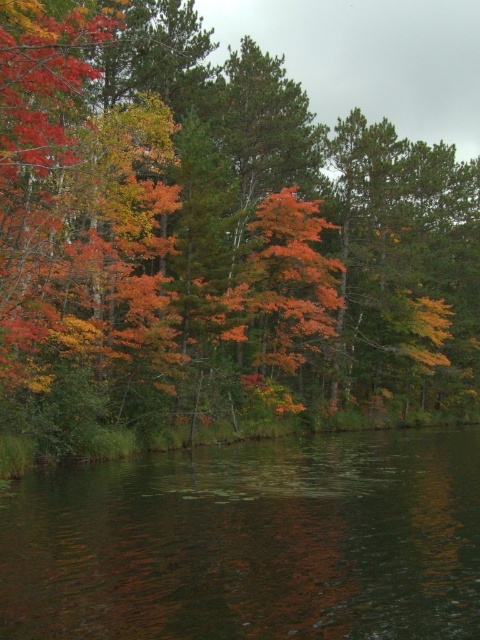
Can you confirm if orange leafy tree at center is positioned to the left of dark reflective water at lower center?

In fact, orange leafy tree at center is to the right of dark reflective water at lower center.

Can you confirm if orange leafy tree at center is taller than dark reflective water at lower center?

Yes.

Which is in front, point (248, 193) or point (58, 564)?

Positioned in front is point (58, 564).

The width and height of the screenshot is (480, 640). I want to click on orange leafy tree at center, so click(214, 236).